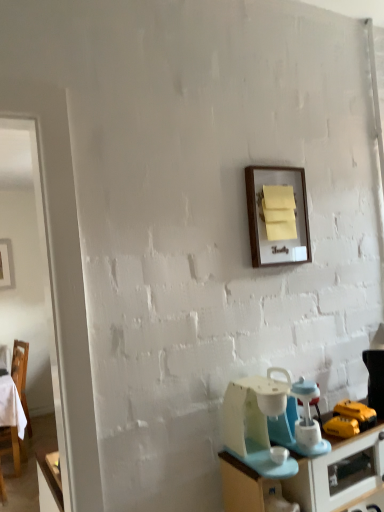
Describe the element at coordinates (253, 410) in the screenshot. I see `light blue plastic blender at lower right` at that location.

What do you see at coordinates (21, 374) in the screenshot?
I see `wooden chair at left` at bounding box center [21, 374].

What is the approximate width of matte blue desk at lower right?

It is 15.52 inches.

At what (x,y) coordinates should I click in order to perform the action: click on matte blue desk at lower right. Please return your answer as a coordinate pair (x, y). Looking at the image, I should click on (336, 474).

Find the location of a particular element. Image resolution: width=384 pixels, height=512 pixels. light blue plastic blender at lower right is located at coordinates (253, 410).

The height and width of the screenshot is (512, 384). I want to click on chair to the left of light blue plastic blender at lower right, so click(x=21, y=374).

Could you tell me if light blue plastic blender at lower right is turned towards wooden chair at left?

No, light blue plastic blender at lower right does not turn towards wooden chair at left.

Considering the sizes of light blue plastic blender at lower right and wooden chair at left in the image, is light blue plastic blender at lower right wider or thinner than wooden chair at left?

light blue plastic blender at lower right is thinner than wooden chair at left.

Which is more to the left, matte blue desk at lower right or light blue plastic blender at lower right?

light blue plastic blender at lower right is more to the left.

Does matte blue desk at lower right have a greater height compared to light blue plastic blender at lower right?

Yes.

In the scene shown: Is matte blue desk at lower right in front of or behind light blue plastic blender at lower right in the image?

Visually, matte blue desk at lower right is located in front of light blue plastic blender at lower right.

Considering the sizes of matte blue desk at lower right and light blue plastic blender at lower right in the image, is matte blue desk at lower right bigger or smaller than light blue plastic blender at lower right?

Considering their sizes, matte blue desk at lower right takes up more space than light blue plastic blender at lower right.

Who is more distant, wooden chair at left or light blue plastic blender at lower right?

wooden chair at left.

Is light blue plastic blender at lower right at the back of wooden chair at left?

No, wooden chair at left is not facing away from light blue plastic blender at lower right.

Considering the positions of objects wooden chair at left and light blue plastic blender at lower right in the image provided, who is more to the right, wooden chair at left or light blue plastic blender at lower right?

light blue plastic blender at lower right.

From the image's perspective, which one is positioned higher, wooden chair at left or light blue plastic blender at lower right?

From the image's view, light blue plastic blender at lower right is above.

Can you confirm if matte blue desk at lower right is shorter than wooden chair at left?

Yes.

Considering their positions, is matte blue desk at lower right located in front of or behind wooden chair at left?

Visually, matte blue desk at lower right is located in front of wooden chair at left.

Based on the photo, is matte blue desk at lower right spatially inside wooden chair at left, or outside of it?

matte blue desk at lower right is not enclosed by wooden chair at left.

Is point (232, 507) closer to camera compared to point (12, 367)?

Yes.

From the image's perspective, which is above, light blue plastic blender at lower right or wooden frame at upper center?

wooden frame at upper center, from the image's perspective.

Is light blue plastic blender at lower right positioned in front of wooden frame at upper center?

Yes, light blue plastic blender at lower right is closer to the camera.

From a real-world perspective, is light blue plastic blender at lower right physically below wooden frame at upper center?

Yes, from a real-world perspective, light blue plastic blender at lower right is beneath wooden frame at upper center.

How many degrees apart are the facing directions of light blue plastic blender at lower right and wooden frame at upper center?

The facing directions of light blue plastic blender at lower right and wooden frame at upper center are 0.796 degrees apart.

Consider the image. In terms of height, does wooden chair at left look taller or shorter compared to wooden frame at upper center?

Considering their sizes, wooden chair at left has more height than wooden frame at upper center.

Could you tell me if wooden chair at left is facing wooden frame at upper center?

No, wooden chair at left is not facing towards wooden frame at upper center.

Would you say wooden frame at upper center is part of wooden chair at left's contents?

Definitely not — wooden frame at upper center is not inside wooden chair at left.

Is wooden chair at left not close to matte blue desk at lower right?

wooden chair at left is far away from matte blue desk at lower right.

Is wooden chair at left behind matte blue desk at lower right?

Yes, wooden chair at left is behind matte blue desk at lower right.

Is wooden chair at left wider or thinner than matte blue desk at lower right?

wooden chair at left is thinner than matte blue desk at lower right.

Which is behind, point (22, 451) or point (218, 455)?

Point (22, 451)

The width and height of the screenshot is (384, 512). Identify the location of chair behind the light blue plastic blender at lower right. (21, 374).

Identify the location of appliance that is on the left side of matte blue desk at lower right. Image resolution: width=384 pixels, height=512 pixels. (253, 410).

When comparing their distances from light blue plastic blender at lower right, does matte blue desk at lower right or wooden chair at left seem closer?

matte blue desk at lower right.

Looking at the image, which one is located further to wooden frame at upper center, matte blue desk at lower right or light blue plastic blender at lower right?

Among the two, matte blue desk at lower right is located further to wooden frame at upper center.

Estimate the real-world distances between objects in this image. Which object is closer to wooden chair at left, light blue plastic blender at lower right or wooden frame at upper center?

light blue plastic blender at lower right.

From the image, which object appears to be farther from matte blue desk at lower right, wooden frame at upper center or wooden chair at left?

wooden chair at left lies further to matte blue desk at lower right than the other object.

Estimate the real-world distances between objects in this image. Which object is closer to matte blue desk at lower right, wooden chair at left or light blue plastic blender at lower right?

light blue plastic blender at lower right.

Considering their positions, is matte blue desk at lower right positioned further to wooden chair at left than wooden frame at upper center?

wooden frame at upper center lies further to wooden chair at left than the other object.

Which object lies further to the anchor point matte blue desk at lower right, wooden frame at upper center or light blue plastic blender at lower right?

wooden frame at upper center is positioned further to the anchor matte blue desk at lower right.

Which object lies further to the anchor point wooden frame at upper center, light blue plastic blender at lower right or wooden chair at left?

wooden chair at left.

You are a GUI agent. You are given a task and a screenshot of the screen. Output one action in this format:
    pyautogui.click(x=<x>, y=<y>)
    Task: Click on the appliance between wooden frame at upper center and matte blue desk at lower right in the up-down direction
    
    Given the screenshot: What is the action you would take?
    pyautogui.click(x=253, y=410)

What are the coordinates of `picture frame between light blue plastic blender at lower right and wooden chair at left in the front-back direction` in the screenshot? It's located at (277, 215).

Find the location of a particular element. This screenshot has width=384, height=512. appliance between matte blue desk at lower right and wooden chair at left from front to back is located at coordinates (253, 410).

Identify the location of picture frame positioned between matte blue desk at lower right and wooden chair at left from near to far. The height and width of the screenshot is (512, 384). (277, 215).